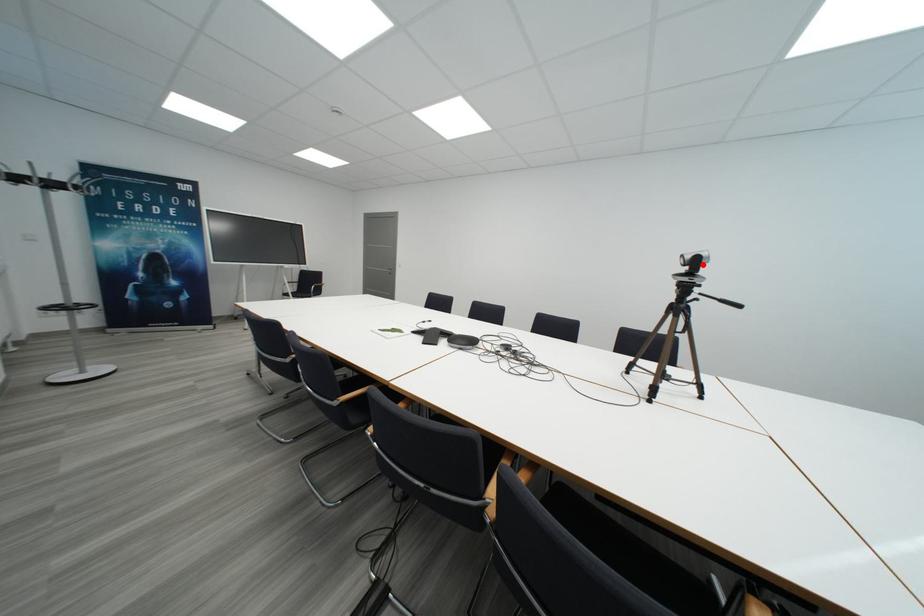
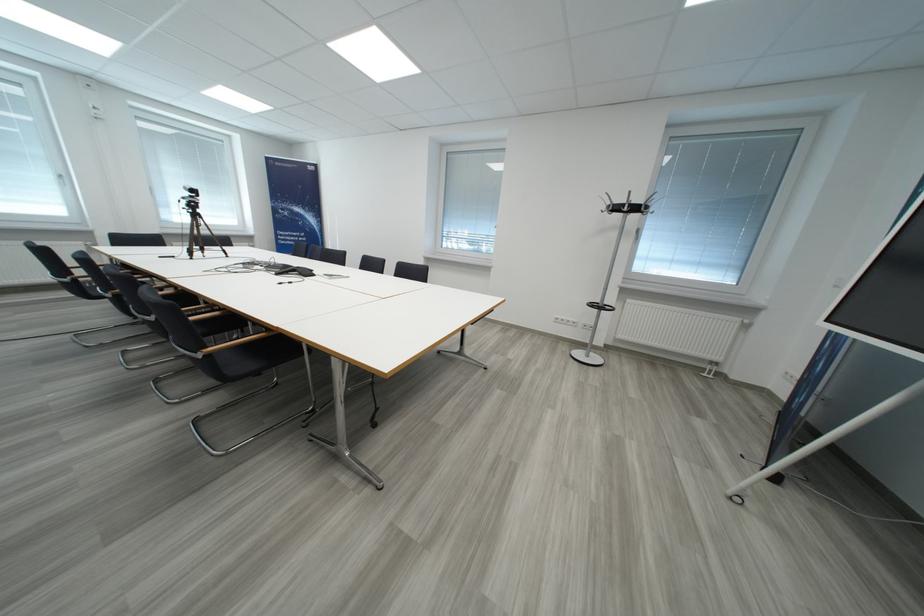
Question: I am providing you with two images of the same scene from different viewpoints. A red point is marked on the first image. Can you still see the location of the red point in image 2?

Choices:
 (A) Yes
 (B) No

Answer: (B)